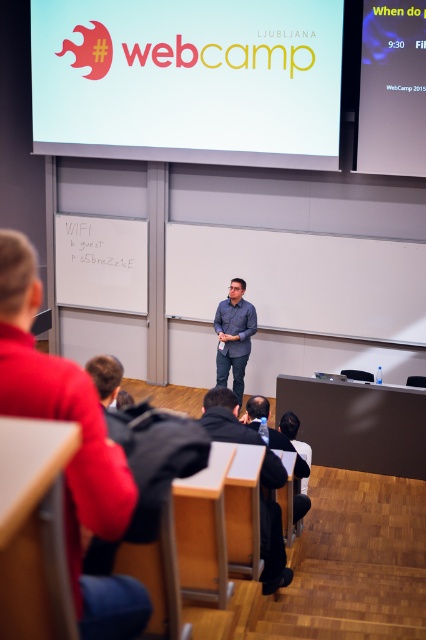
You are standing in the front of the room at WebCamp Ljubljana. You need to walk to point A at coordinates point(x=250, y=26) and point B at coordinates point(x=19, y=234). Which point will you reach first?

Point A at coordinates point(x=250, y=26) is closer to you, so you will reach it first.

You are sitting at the back of the room and want to see the person wearing the matte gray shirt at center. Is the black fabric jacket at lower center blocking your view of them?

The matte gray shirt at center is located above the black fabric jacket at lower center, so the jacket is blocking part of the view of the person wearing the matte gray shirt at center.